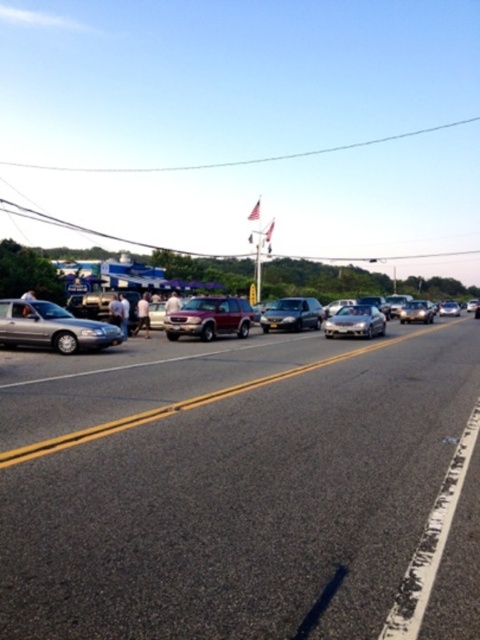
You are standing at the point with coordinates point (x=432, y=310) and want to walk to the point with coordinates point (x=48, y=324). Which direction should you move to get closer to your destination?

You should move forward because point (x=48, y=324) is in front of point (x=432, y=310).

You are a delivery person trying to park your van between the silver metallic sedan at left and the satin silver sedan at center. Your van is 2 meters wide. Can you fit your van between them?

The silver metallic sedan at left has a lesser width compared to satin silver sedan at center, but without knowing the exact distance between them, it is impossible to determine if the van can fit. The question requires information about the space between the two sedans, but the provided description only compares their widths, not their separation. Therefore, the answer cannot be definitively determined with the given information.

What are the coordinates of the satin silver car at center?

The satin silver car at center is located at coordinates point [356,321].